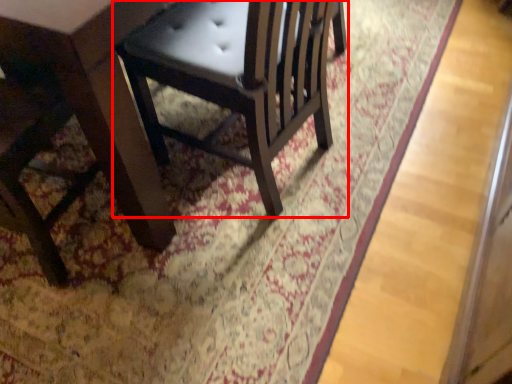
Question: From the image's perspective, what is the correct spatial positioning of chair (annotated by the red box) in reference to table?

Choices:
 (A) below
 (B) above

Answer: (B)